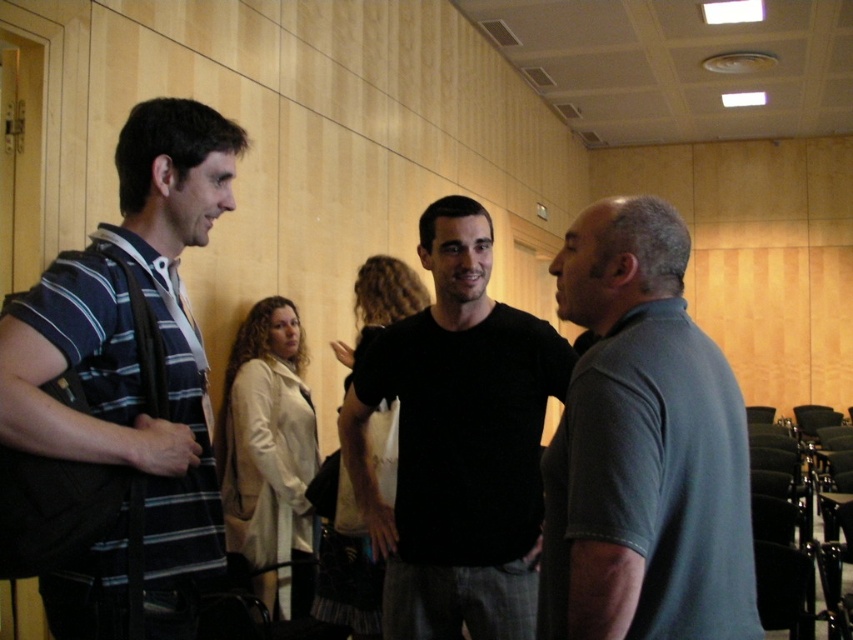
Which of these two, gray cotton polo shirt at right or black matte shirt at center, stands shorter?

gray cotton polo shirt at right is shorter.

Which is below, gray cotton polo shirt at right or black matte shirt at center?

Positioned lower is black matte shirt at center.

Where is `gray cotton polo shirt at right`? gray cotton polo shirt at right is located at coordinates (643, 449).

You are a GUI agent. You are given a task and a screenshot of the screen. Output one action in this format:
    pyautogui.click(x=<x>, y=<y>)
    Task: Click on the gray cotton polo shirt at right
    
    Given the screenshot: What is the action you would take?
    pyautogui.click(x=643, y=449)

Which of these two, gray cotton polo shirt at right or striped cotton shirt at left, stands shorter?

With less height is gray cotton polo shirt at right.

Is gray cotton polo shirt at right positioned in front of striped cotton shirt at left?

Yes, gray cotton polo shirt at right is in front of striped cotton shirt at left.

Does point (693, 608) come behind point (53, 628)?

No, it is in front of (53, 628).

Find the location of a particular element. gray cotton polo shirt at right is located at coordinates (643, 449).

In the scene shown: Is striped cotton shirt at left further to the viewer compared to black matte shirt at center?

That is False.

Which is behind, point (68, 436) or point (399, 508)?

The point (399, 508) is behind.

At what (x,y) coordinates should I click in order to perform the action: click on striped cotton shirt at left. Please return your answer as a coordinate pair (x, y). This screenshot has width=853, height=640. Looking at the image, I should click on (134, 348).

Locate an element on the screen. The width and height of the screenshot is (853, 640). striped cotton shirt at left is located at coordinates (134, 348).